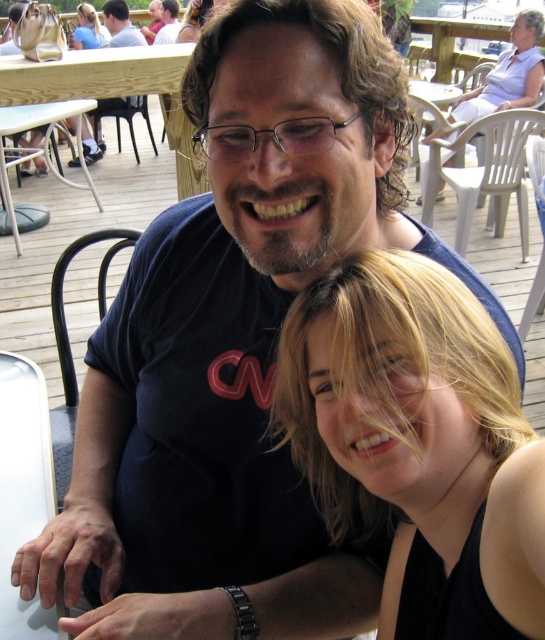
You are a photographer trying to capture a candid shot of the blonde hair at lower right and the white plastic table at lower left. Based on their heights, which one should you focus on first to ensure they are both in frame?

The blonde hair at lower right is shorter than the white plastic table at lower left, so you should focus on the white plastic table at lower left first to ensure both are in frame.

You are a photographer trying to capture a candid shot of the blonde hair at upper center without the white plastic table at lower left blocking the view. Based on their heights, can you position yourself so that the table doesn

The white plastic table at lower left is taller than the blonde hair at upper center, so positioning yourself lower might allow you to capture the blonde hair at upper center without the table blocking the view.